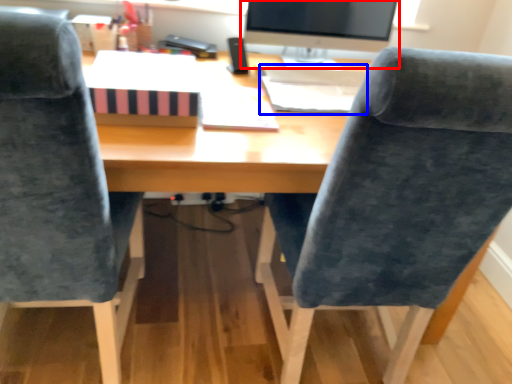
Question: Among these objects, which one is farthest to the camera, computer monitor (highlighted by a red box) or book (highlighted by a blue box)?

Choices:
 (A) computer monitor
 (B) book

Answer: (A)